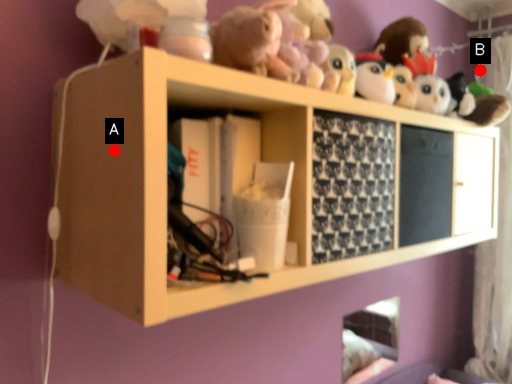
Question: Two points are circled on the image, labeled by A and B beside each circle. Which of the following is the closest to the observer?

Choices:
 (A) A is closer
 (B) B is closer

Answer: (A)